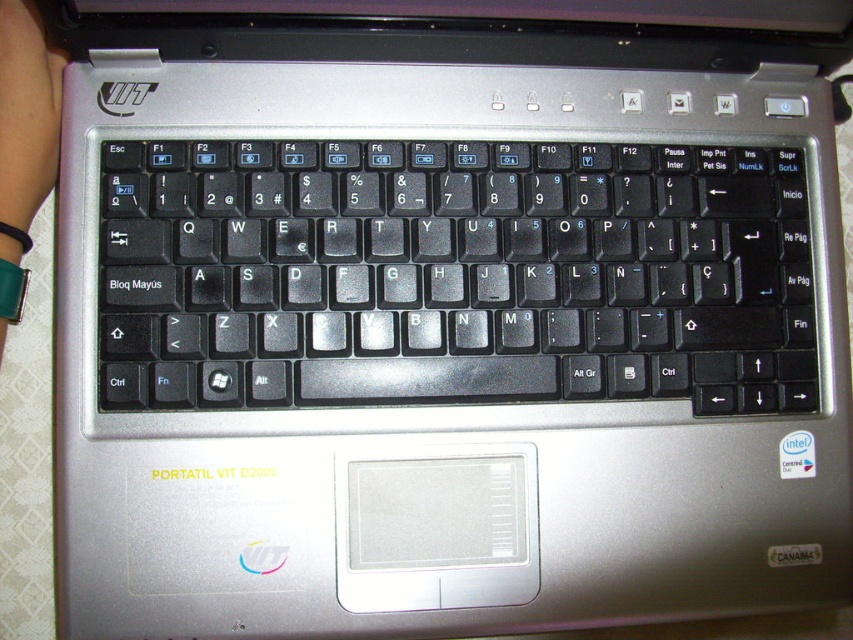
You are a photographer setting up a product shot of the laptop keyboard. You need to focus on the black plastic keyboard at center and the green leather wristband at lower left. Which object should you adjust your camera focus on first to ensure both are in focus?

The black plastic keyboard at center is further to the viewer than the green leather wristband at lower left. To ensure both are in focus, you should focus on the green leather wristband at lower left first, as it is closer to the camera, allowing the depth of field to cover the farther keyboard.

You are setting up a laptop workspace and need to place the green leather wristband at lower left next to the black plastic keyboard at center. Based on their sizes, will the wristband fit horizontally next to the keyboard without overlapping?

The black plastic keyboard at center is wider than the green leather wristband at lower left. Since the keyboard is wider, there should be enough space to place the green leather wristband at lower left next to it without overlapping, as the wristband is narrower.

You are setting up a laptop on a desk and notice two items on the desk surface. You have the black plastic keyboard at center and the green leather wristband at lower left. Which item is positioned more to the right side of the desk?

The black plastic keyboard at center is positioned to the right of the green leather wristband at lower left, so the black plastic keyboard at center is more to the right side of the desk.